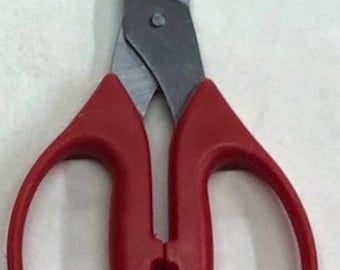
The image size is (340, 270). Identify the location of the left handle. (135, 194).